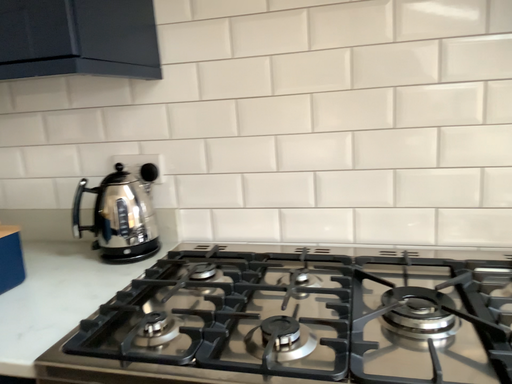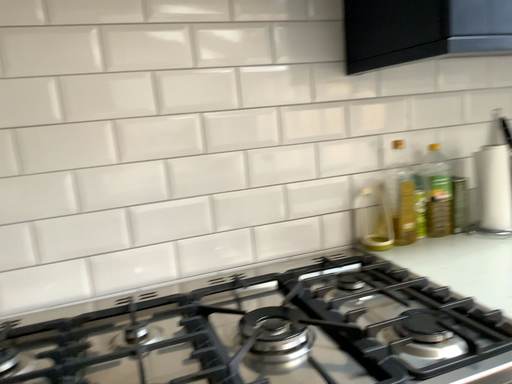
Question: Which way did the camera rotate in the video?

Choices:
 (A) rotated left
 (B) rotated right

Answer: (B)